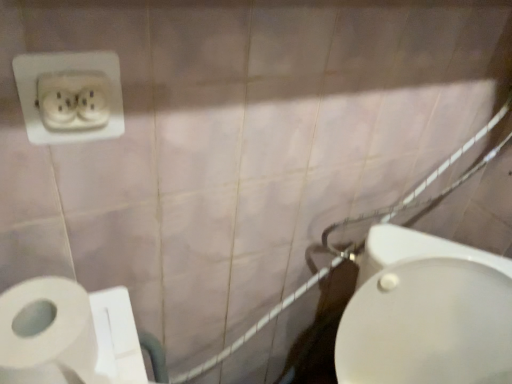
The image size is (512, 384). Describe the element at coordinates (70, 96) in the screenshot. I see `white plastic power plugs and sockets at upper left` at that location.

The height and width of the screenshot is (384, 512). Identify the location of white ceramic shower at right. (426, 184).

Is white plastic power plugs and sockets at upper left looking in the opposite direction of white matte toilet paper at lower left?

No, white plastic power plugs and sockets at upper left's orientation is not away from white matte toilet paper at lower left.

The image size is (512, 384). Find the location of `toilet paper lying below the white plastic power plugs and sockets at upper left (from the image's perspective)`. toilet paper lying below the white plastic power plugs and sockets at upper left (from the image's perspective) is located at coordinates (47, 333).

In the scene shown: Does white plastic power plugs and sockets at upper left appear on the right side of white matte toilet paper at lower left?

Incorrect, white plastic power plugs and sockets at upper left is not on the right side of white matte toilet paper at lower left.

Considering the points (335, 355) and (450, 187), which point is behind, point (335, 355) or point (450, 187)?

Point (335, 355)

From a real-world perspective, relative to white ceramic shower at right, is white glossy bidet at lower right vertically above or below?

From a real-world perspective, white glossy bidet at lower right is physically below white ceramic shower at right.

Could you tell me if white glossy bidet at lower right is facing white ceramic shower at right?

No, white glossy bidet at lower right is not oriented towards white ceramic shower at right.

Is white glossy bidet at lower right positioned behind white ceramic shower at right?

No, the depth of white glossy bidet at lower right is less than that of white ceramic shower at right.

Considering the sizes of objects white matte toilet paper at lower left and white glossy bidet at lower right in the image provided, who is bigger, white matte toilet paper at lower left or white glossy bidet at lower right?

Bigger between the two is white glossy bidet at lower right.

This screenshot has height=384, width=512. In the image, there is a white matte toilet paper at lower left. What are the coordinates of `bidet below it (from a real-world perspective)` in the screenshot? It's located at (428, 325).

In terms of width, does white matte toilet paper at lower left look wider or thinner when compared to white glossy bidet at lower right?

In the image, white matte toilet paper at lower left appears to be more narrow than white glossy bidet at lower right.

Consider the image. From a real-world perspective, between white matte toilet paper at lower left and white glossy bidet at lower right, who is vertically lower?

white glossy bidet at lower right.

From a real-world perspective, is white ceramic shower at right on white glossy bidet at lower right?

Yes, from a real-world perspective, white ceramic shower at right is over white glossy bidet at lower right

Identify the location of shower above the white glossy bidet at lower right (from a real-world perspective). (426, 184).

Is white ceramic shower at right far from white glossy bidet at lower right?

No.

How different are the orientations of white ceramic shower at right and white glossy bidet at lower right in degrees?

49.9 degrees separate the facing orientations of white ceramic shower at right and white glossy bidet at lower right.

Is white plastic power plugs and sockets at upper left taller or shorter than white glossy bidet at lower right?

white plastic power plugs and sockets at upper left is shorter than white glossy bidet at lower right.

From a real-world perspective, relative to white glossy bidet at lower right, is white plastic power plugs and sockets at upper left vertically above or below?

white plastic power plugs and sockets at upper left is above white glossy bidet at lower right.

How much distance is there between white plastic power plugs and sockets at upper left and white glossy bidet at lower right?

white plastic power plugs and sockets at upper left and white glossy bidet at lower right are 26.82 inches apart from each other.

Does white plastic power plugs and sockets at upper left lie behind white glossy bidet at lower right?

Yes, it is.

Are white ceramic shower at right and white plastic power plugs and sockets at upper left beside each other?

No, white ceramic shower at right is not making contact with white plastic power plugs and sockets at upper left.

Between white ceramic shower at right and white plastic power plugs and sockets at upper left, which one is positioned behind?

white ceramic shower at right is more distant.

Considering the sizes of objects white ceramic shower at right and white plastic power plugs and sockets at upper left in the image provided, who is smaller, white ceramic shower at right or white plastic power plugs and sockets at upper left?

Smaller between the two is white plastic power plugs and sockets at upper left.

Could you tell me if white matte toilet paper at lower left is facing white plastic power plugs and sockets at upper left?

No, white matte toilet paper at lower left is not aimed at white plastic power plugs and sockets at upper left.

Is point (74, 347) behind point (52, 131)?

No.

Where is `toilet paper located below the white plastic power plugs and sockets at upper left (from the image's perspective)`? The width and height of the screenshot is (512, 384). toilet paper located below the white plastic power plugs and sockets at upper left (from the image's perspective) is located at coordinates (47, 333).

At what (x,y) coordinates should I click in order to perform the action: click on toilet paper beneath the white plastic power plugs and sockets at upper left (from a real-world perspective). Please return your answer as a coordinate pair (x, y). This screenshot has width=512, height=384. Looking at the image, I should click on (47, 333).

This screenshot has width=512, height=384. What are the coordinates of `shower above the white glossy bidet at lower right (from a real-world perspective)` in the screenshot? It's located at (426, 184).

Which object lies nearer to the anchor point white glossy bidet at lower right, white ceramic shower at right or white plastic power plugs and sockets at upper left?

white ceramic shower at right.

Estimate the real-world distances between objects in this image. Which object is closer to white plastic power plugs and sockets at upper left, white matte toilet paper at lower left or white ceramic shower at right?

white matte toilet paper at lower left lies closer to white plastic power plugs and sockets at upper left than the other object.

Considering their positions, is white matte toilet paper at lower left positioned closer to white glossy bidet at lower right than white plastic power plugs and sockets at upper left?

Based on the image, white matte toilet paper at lower left appears to be nearer to white glossy bidet at lower right.

Based on their spatial positions, is white plastic power plugs and sockets at upper left or white glossy bidet at lower right further from white ceramic shower at right?

The object further to white ceramic shower at right is white plastic power plugs and sockets at upper left.

Looking at the image, which one is located closer to white plastic power plugs and sockets at upper left, white matte toilet paper at lower left or white glossy bidet at lower right?

white matte toilet paper at lower left is closer to white plastic power plugs and sockets at upper left.

Based on their spatial positions, is white glossy bidet at lower right or white plastic power plugs and sockets at upper left further from white matte toilet paper at lower left?

white glossy bidet at lower right lies further to white matte toilet paper at lower left than the other object.

Based on their spatial positions, is white matte toilet paper at lower left or white glossy bidet at lower right further from white ceramic shower at right?

Based on the image, white matte toilet paper at lower left appears to be further to white ceramic shower at right.

From the image, which object appears to be nearer to white matte toilet paper at lower left, white plastic power plugs and sockets at upper left or white glossy bidet at lower right?

white plastic power plugs and sockets at upper left.

Identify the location of toilet paper located between white plastic power plugs and sockets at upper left and white ceramic shower at right in the left-right direction. (47, 333).

Identify the location of bidet between white matte toilet paper at lower left and white ceramic shower at right in the horizontal direction. The height and width of the screenshot is (384, 512). (428, 325).

Find the location of `toilet paper situated between white plastic power plugs and sockets at upper left and white glossy bidet at lower right from left to right`. toilet paper situated between white plastic power plugs and sockets at upper left and white glossy bidet at lower right from left to right is located at coordinates (47, 333).

Find the location of `bidet between white plastic power plugs and sockets at upper left and white ceramic shower at right from left to right`. bidet between white plastic power plugs and sockets at upper left and white ceramic shower at right from left to right is located at coordinates tap(428, 325).